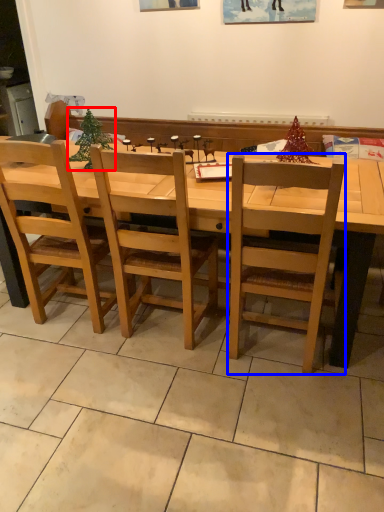
Question: Among these objects, which one is nearest to the camera, christmas tree (highlighted by a red box) or chair (highlighted by a blue box)?

Choices:
 (A) christmas tree
 (B) chair

Answer: (B)